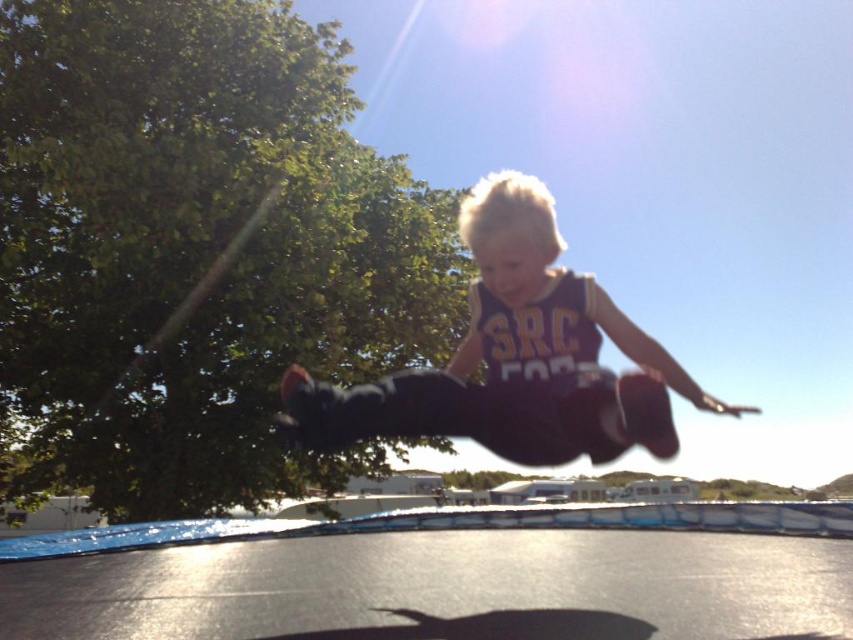
Does black rubber trampoline at center have a smaller size compared to purple jersey at center?

Yes, black rubber trampoline at center is smaller than purple jersey at center.

Identify the location of black rubber trampoline at center. (450, 577).